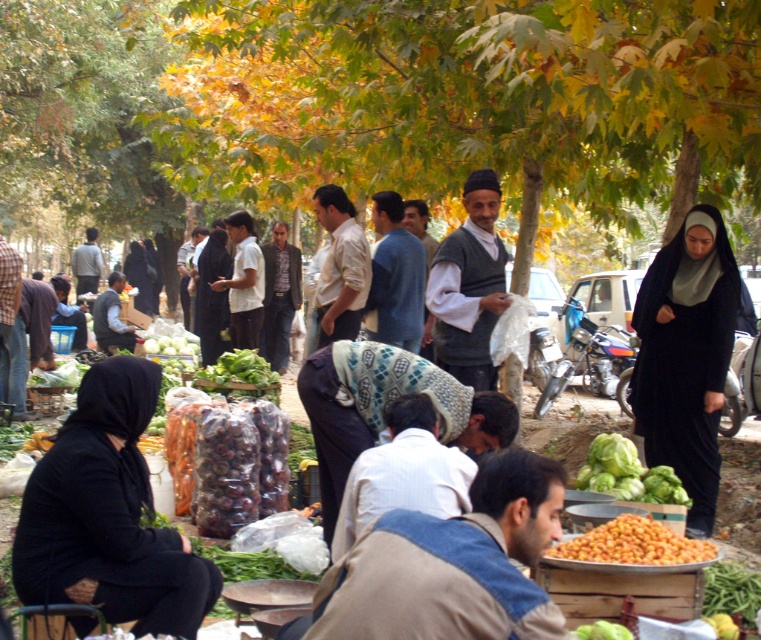
Who is more distant from viewer, (664, 385) or (613, 518)?

The point (664, 385) is behind.

Is black fabric hijab at center thinner than orange matte fruit at lower right?

Indeed, black fabric hijab at center has a lesser width compared to orange matte fruit at lower right.

Who is more forward, (x=721, y=273) or (x=610, y=545)?

Point (x=610, y=545) is in front.

Where is `black fabric hijab at center`? This screenshot has width=761, height=640. black fabric hijab at center is located at coordinates point(686,356).

Is black fabric headscarf at lower left above green leafy at center?

Incorrect, black fabric headscarf at lower left is not positioned above green leafy at center.

The image size is (761, 640). I want to click on black fabric headscarf at lower left, so click(x=107, y=515).

Which is more to the left, black fabric headscarf at lower left or green leafy vegetables at center?

black fabric headscarf at lower left is more to the left.

Is black fabric headscarf at lower left shorter than green leafy vegetables at center?

Incorrect, black fabric headscarf at lower left's height does not fall short of green leafy vegetables at center's.

Between point (185, 548) and point (587, 461), which one is positioned in front?

Positioned in front is point (185, 548).

Image resolution: width=761 pixels, height=640 pixels. I want to click on black fabric headscarf at lower left, so click(x=107, y=515).